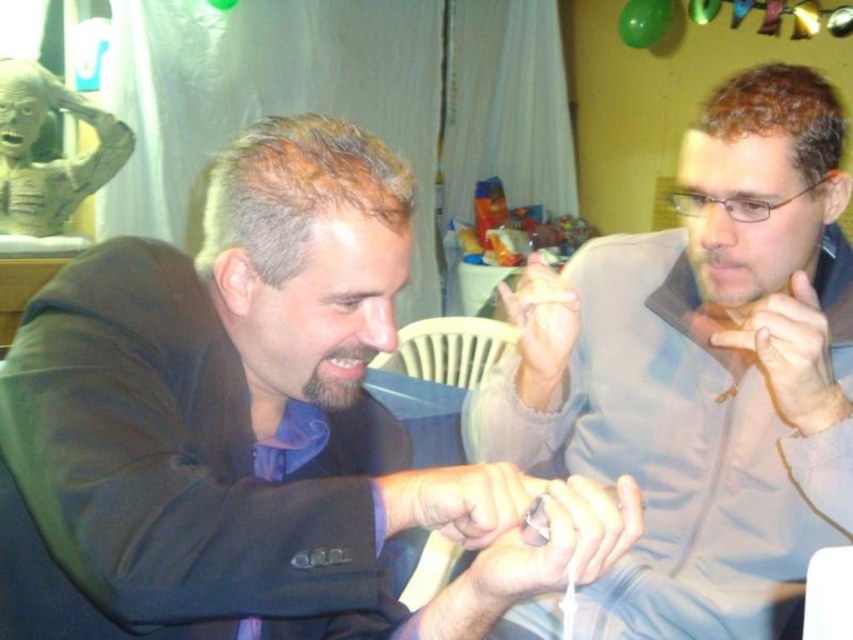
You are organizing a clothing donation drive and need to determine if the matte black jacket at left and the light brown leather jacket at right can fit into a standard donation box that measures 30x30 cm. Given their sizes, which jacket is more likely to fit without folding?

The matte black jacket at left is smaller in size compared to the light brown leather jacket at right, so it is more likely to fit into the standard donation box without folding.

You are standing at the origin point of a coordinate system where the bottom left corner is at position 0.000, 0.000 and the top right corner is at 1.000, 1.000. You want to locate the matte black jacket at left. What are its coordinates?

The coordinates of the matte black jacket at left are at point (254,429).